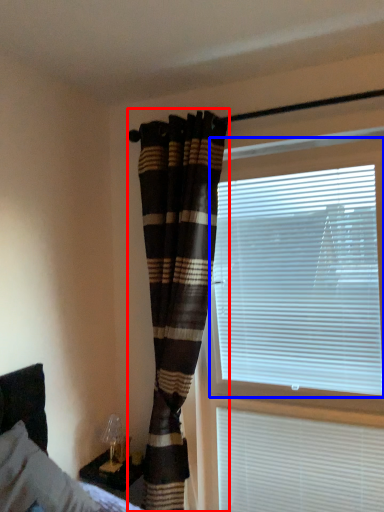
Question: Which point is further to the camera, curtain (highlighted by a red box) or window blind (highlighted by a blue box)?

Choices:
 (A) curtain
 (B) window blind

Answer: (A)